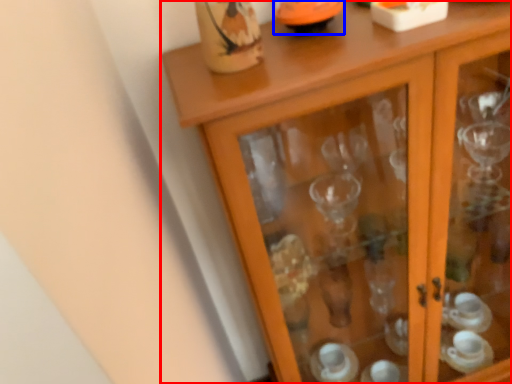
Question: Which object appears closest to the camera in this image, cupboard (highlighted by a red box) or tableware (highlighted by a blue box)?

Choices:
 (A) cupboard
 (B) tableware

Answer: (A)